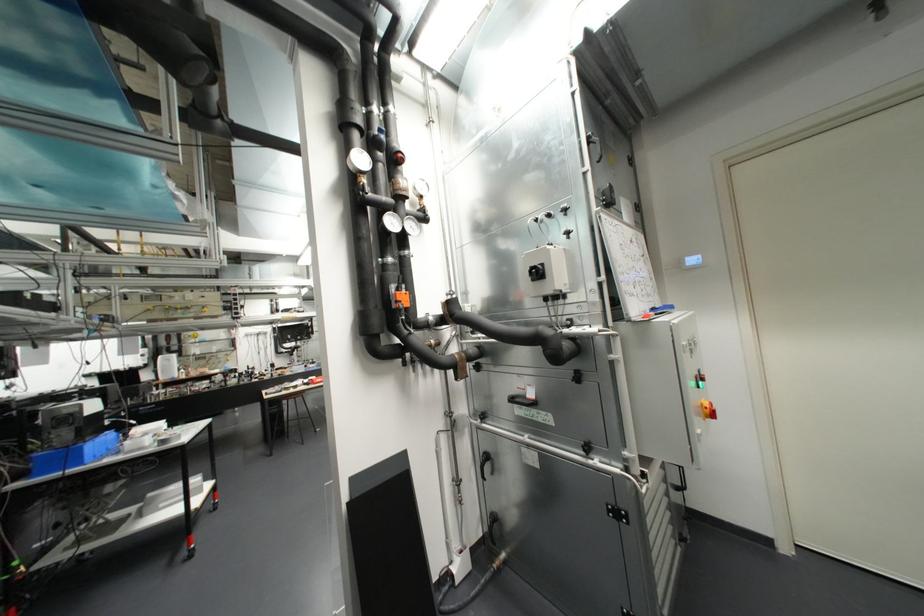
Identify the location of yellow rotary switch. This screenshot has width=924, height=616. (707, 410).